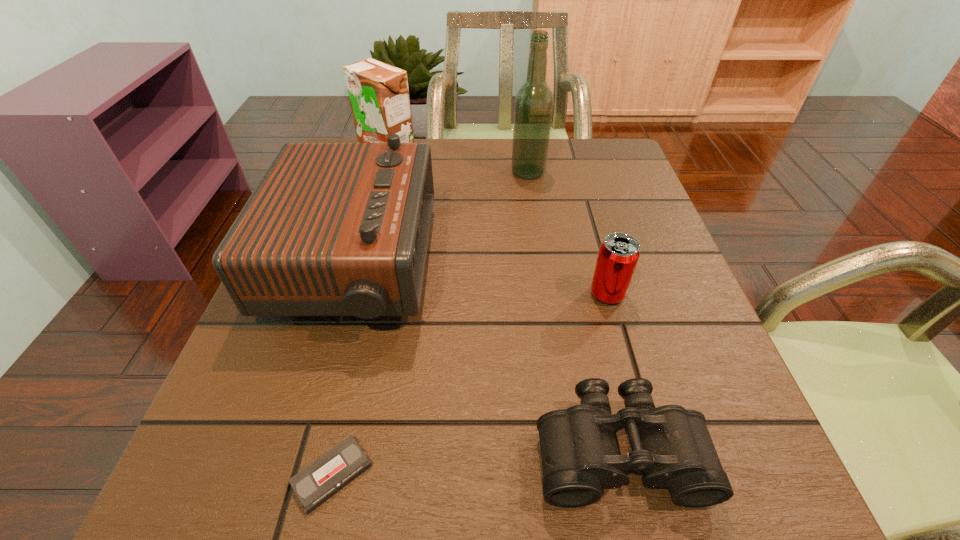
This screenshot has height=540, width=960. I want to click on object positioned at the far left corner, so click(x=379, y=97).

The image size is (960, 540). In order to click on object that is positioned at the near left corner in this screenshot , I will do (319, 481).

In order to click on object that is at the near right corner in this screenshot , I will do `click(671, 445)`.

What are the coordinates of `blank space at the far edge of the desktop` in the screenshot? It's located at (x=468, y=186).

This screenshot has height=540, width=960. In order to click on free region at the left edge of the desktop in this screenshot , I will do `click(292, 335)`.

Where is `blank space at the right edge of the desktop`? This screenshot has width=960, height=540. blank space at the right edge of the desktop is located at coordinates (667, 276).

Find the location of a particular element. The height and width of the screenshot is (540, 960). vacant space at the far right corner of the desktop is located at coordinates (592, 139).

Find the location of a particular element. The width and height of the screenshot is (960, 540). free space between the binoculars and the carton is located at coordinates (503, 304).

Identify the location of free spot between the fifth tallest object and the radio receiver. The width and height of the screenshot is (960, 540). (487, 359).

Where is `free space between the carton and the second shortest object`? This screenshot has width=960, height=540. free space between the carton and the second shortest object is located at coordinates (503, 304).